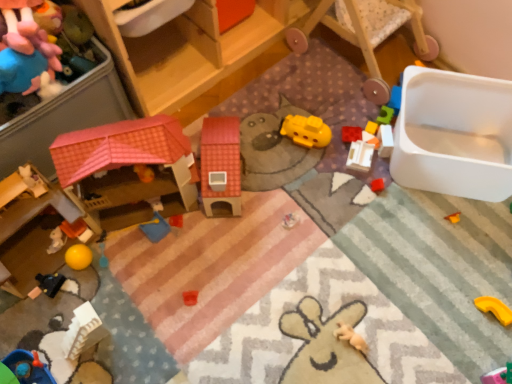
At what (x,y) coordinates should I click in order to perform the action: click on free space to the left of yellow matte block at upper right, positioned as the 3th toy in right-to-left order. Please return your answer as a coordinate pair (x, y). This screenshot has height=384, width=512. Looking at the image, I should click on (331, 135).